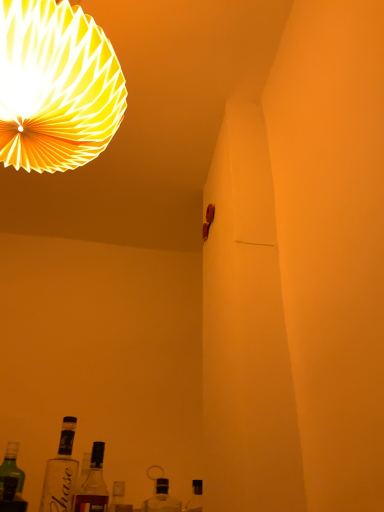
Question: Does translucent glass bottle at lower center, which ranks as the second bottle in left-to-right order, have a greater height compared to white paper lampshade at upper left?

Choices:
 (A) no
 (B) yes

Answer: (A)

Question: Considering the relative sizes of translucent glass bottle at lower center, which ranks as the second bottle in left-to-right order, and white paper lampshade at upper left in the image provided, is translucent glass bottle at lower center, which ranks as the second bottle in left-to-right order, bigger than white paper lampshade at upper left?

Choices:
 (A) no
 (B) yes

Answer: (A)

Question: Does translucent glass bottle at lower center, which is the second bottle in right-to-left order, touch white paper lampshade at upper left?

Choices:
 (A) no
 (B) yes

Answer: (A)

Question: Does translucent glass bottle at lower center, which ranks as the second bottle in left-to-right order, lie in front of white paper lampshade at upper left?

Choices:
 (A) yes
 (B) no

Answer: (B)

Question: Can you confirm if translucent glass bottle at lower center, which ranks as the second bottle in left-to-right order, is wider than white paper lampshade at upper left?

Choices:
 (A) yes
 (B) no

Answer: (B)

Question: Would you consider translucent glass bottle at lower center, which is the second bottle in right-to-left order, to be distant from white paper lampshade at upper left?

Choices:
 (A) yes
 (B) no

Answer: (B)

Question: From a real-world perspective, is clear glass bottle at lower left, the 3th bottle viewed from the right, below white paper lampshade at upper left?

Choices:
 (A) no
 (B) yes

Answer: (B)

Question: Is the position of clear glass bottle at lower left, the 3th bottle viewed from the right, more distant than that of white paper lampshade at upper left?

Choices:
 (A) yes
 (B) no

Answer: (A)

Question: Could you tell me if clear glass bottle at lower left, the 3th bottle viewed from the right, is turned towards white paper lampshade at upper left?

Choices:
 (A) yes
 (B) no

Answer: (B)

Question: Considering the relative sizes of clear glass bottle at lower left, the 1th bottle positioned from the left, and white paper lampshade at upper left in the image provided, is clear glass bottle at lower left, the 1th bottle positioned from the left, taller than white paper lampshade at upper left?

Choices:
 (A) no
 (B) yes

Answer: (A)

Question: Can you confirm if clear glass bottle at lower left, the 1th bottle positioned from the left, is bigger than white paper lampshade at upper left?

Choices:
 (A) yes
 (B) no

Answer: (B)

Question: Is clear glass bottle at lower left, the 1th bottle positioned from the left, located outside white paper lampshade at upper left?

Choices:
 (A) yes
 (B) no

Answer: (A)

Question: Are clear glass bottle at lower left, the 3th bottle viewed from the right, and clear glass bottle at lower center, placed as the 1th bottle when sorted from right to left, making contact?

Choices:
 (A) no
 (B) yes

Answer: (A)